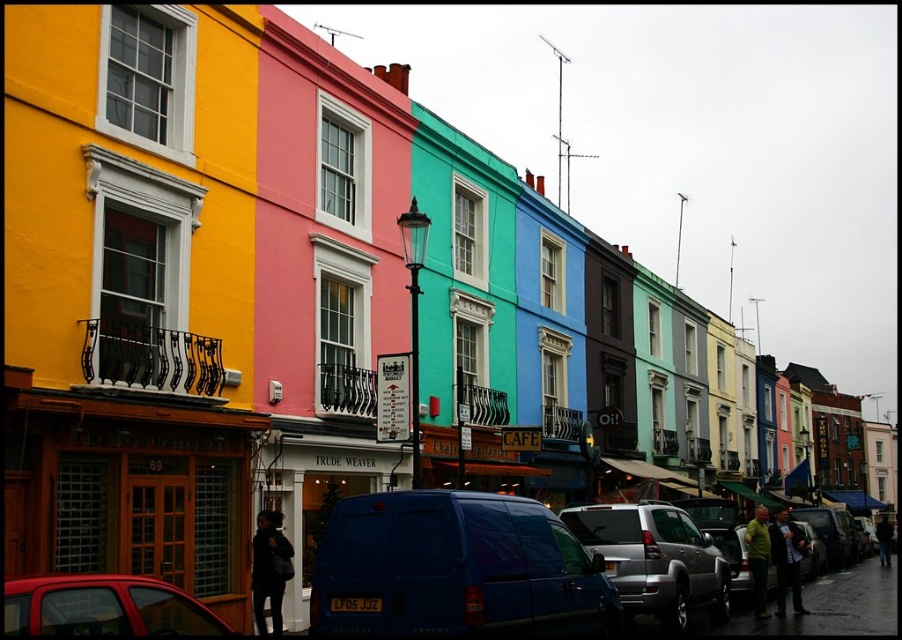
You are standing on the sidewalk in the street scene. You want to take a photo of the point at coordinates point (310, 628). If your camera has a focal length of 50mm and you are currently 40 meters away from that point, should you move closer or farther away to focus properly?

The point point (310, 628) is 41.16 meters away from the camera. Since you are currently 40 meters away, you should move slightly farther away to match the 41.16 meter distance for proper focus.

You are a delivery person who needs to park your vehicle in this street scene. You have a metallic silver suv at center and a metallic red car at lower left. Which vehicle should you choose to park closer to the sidewalk?

The metallic silver suv at center is located below the metallic red car at lower left, meaning it is closer to the sidewalk. Therefore, you should choose the metallic silver suv at center to park closer to the sidewalk.

You are a pedestrian standing on the sidewalk and want to cross the street to reach the row of colorful houses. You see a metallic silver suv at center and a metallic red car at lower left. Which vehicle is closer to the sidewalk where you are standing?

The metallic red car at lower left is closer to the sidewalk where you are standing because it is positioned to the left of the metallic silver suv at center, which is further away.